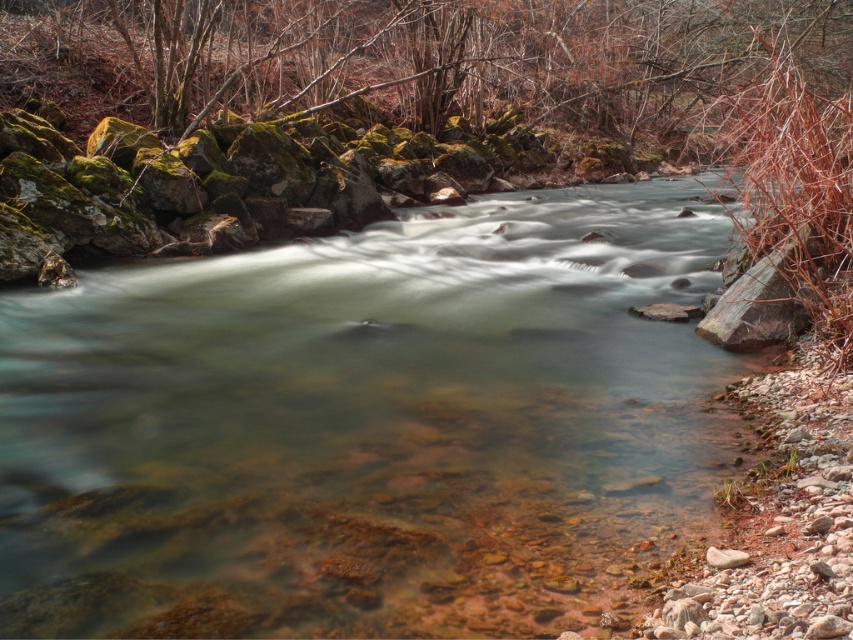
Between clear water at center and green mossy rock at upper center, which one appears on the right side from the viewer's perspective?

From the viewer's perspective, green mossy rock at upper center appears more on the right side.

Does clear water at center appear under green mossy rock at upper center?

Yes.

Which is behind, point (62, 308) or point (264, 29)?

The point (264, 29) is more distant.

You are a GUI agent. You are given a task and a screenshot of the screen. Output one action in this format:
    pyautogui.click(x=<x>, y=<y>)
    Task: Click on the clear water at center
    This screenshot has height=640, width=853.
    Given the screenshot: What is the action you would take?
    pyautogui.click(x=364, y=426)